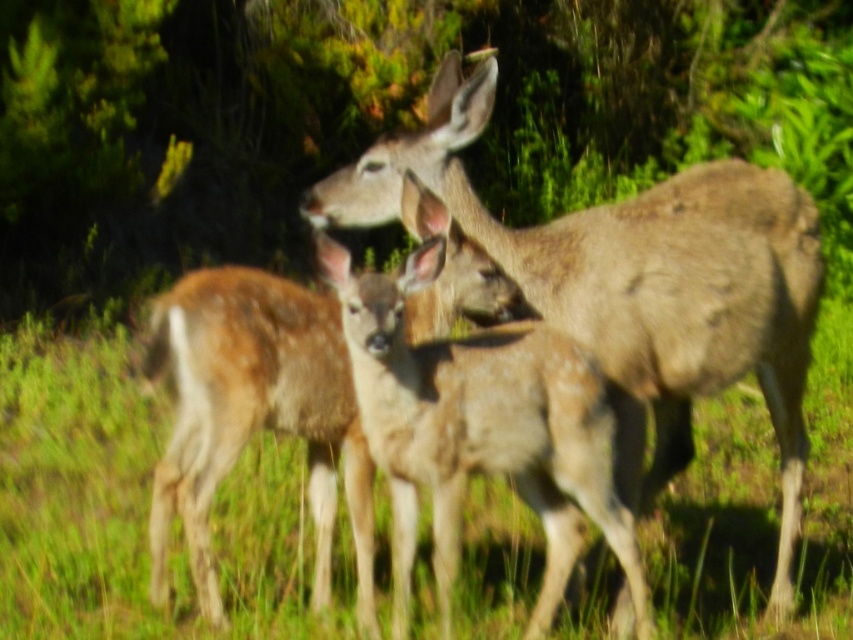
Can you confirm if brown fur deer at center is taller than spotted fur deer at center?

Yes, brown fur deer at center is taller than spotted fur deer at center.

Is brown fur deer at center positioned in front of spotted fur deer at center?

No.

In order to click on brown fur deer at center in this screenshot , I will do `click(636, 282)`.